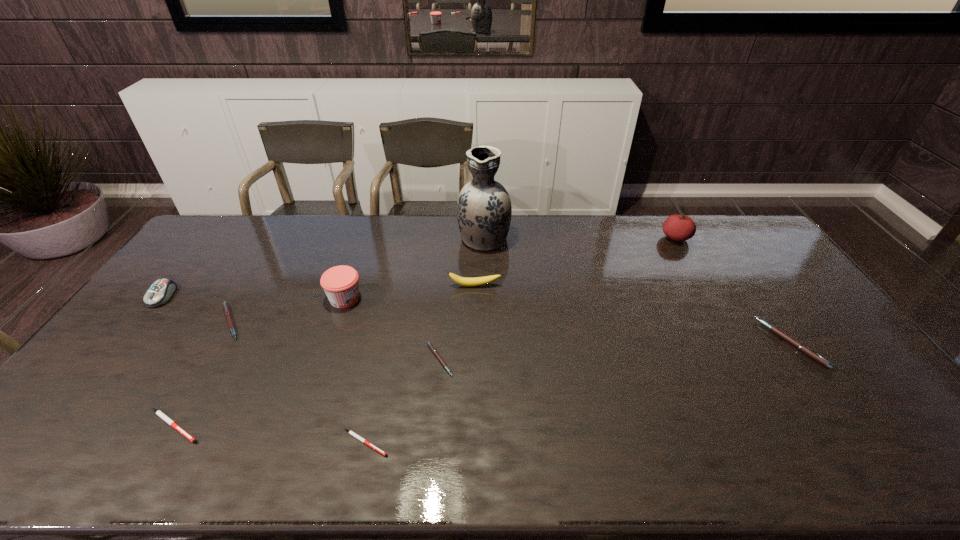
Identify the location of object that is the third closest to the left white pen. This screenshot has height=540, width=960. (340, 283).

The width and height of the screenshot is (960, 540). Find the location of `pen that stands as the second closest to the second object from right to left`. pen that stands as the second closest to the second object from right to left is located at coordinates (429, 344).

Where is `pen object that ranks as the closest to the fifth tallest object`? This screenshot has width=960, height=540. pen object that ranks as the closest to the fifth tallest object is located at coordinates (227, 312).

I want to click on the closest pink pen to the seventh object from right to left, so click(227, 312).

Where is `pink pen that is the third closest one to the fourth object from left to right`? pink pen that is the third closest one to the fourth object from left to right is located at coordinates (797, 344).

The image size is (960, 540). I want to click on free space that satisfies the following two spatial constraints: 1. on the upward curve of the fourth tallest object; 2. on the clicker of the smaller white pen, so click(472, 443).